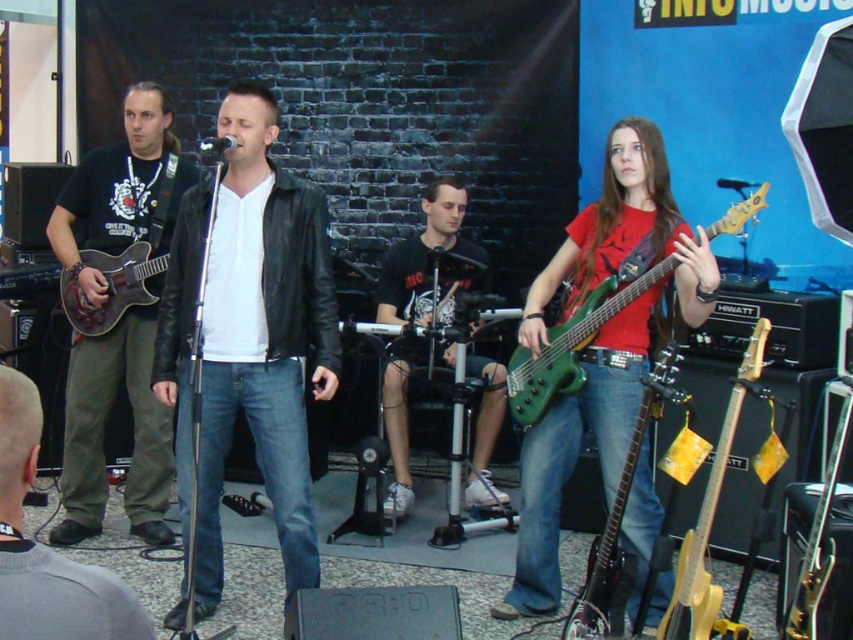
What object is located at the coordinate point (709,516) in the image?

The yellow matte electric guitar at center right is located at the coordinate point (709,516).

What are the coordinates of the matte black guitar at left?

The coordinates of the matte black guitar at left are at point (103,432).

You are a photographer at the live music venue. You want to take a photo of the matte black guitar at left and the dark brown leather pants at lower left. Since you have a limited space in your frame, which object should you focus on to ensure it fits better in the frame?

The dark brown leather pants at lower left is smaller than the matte black guitar at left, so focusing on it would ensure better fit in the frame.